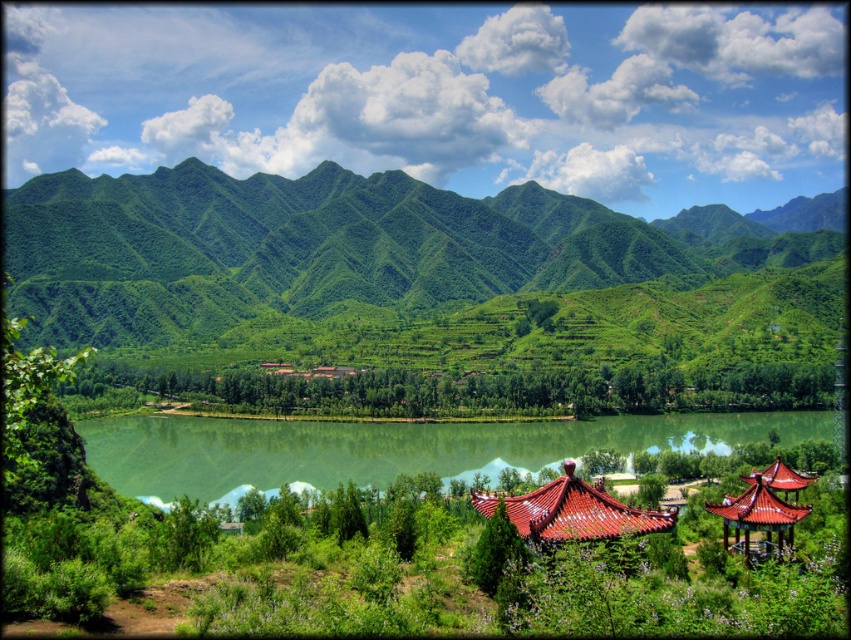
You are standing at the edge of the green smooth water at center in the image. Looking towards the green textured mountain at center, which direction should you face?

You should face to the left because the green textured mountain at center is to the right of green smooth water at center.

You are planning to take a photo of the green textured mountain at center and the shiny red tile gazebo at center from a drone. Which object will appear wider in the photo?

The green textured mountain at center will appear wider in the photo because its width surpasses that of the shiny red tile gazebo at center.

You are standing in the serene landscape and want to determine which of the two points, point (604, 528) or point (752, 484), is nearer to you. Based on the scene, which point is closer?

Point (604, 528) is closer to the viewer than point (752, 484).